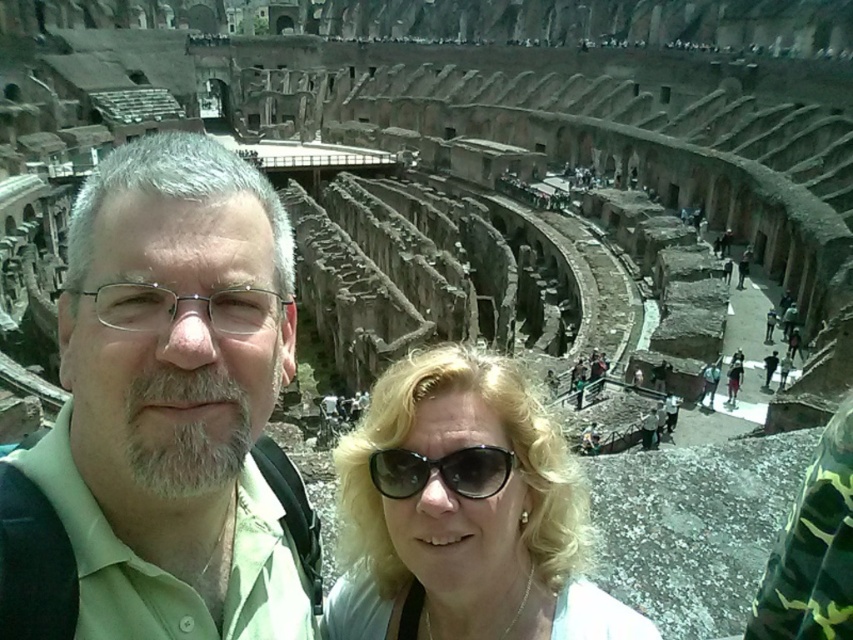
Does green matte shirt at center appear over black plastic sunglasses at center?

Correct, green matte shirt at center is located above black plastic sunglasses at center.

You are a GUI agent. You are given a task and a screenshot of the screen. Output one action in this format:
    pyautogui.click(x=<x>, y=<y>)
    Task: Click on the green matte shirt at center
    The image size is (853, 640).
    Given the screenshot: What is the action you would take?
    pyautogui.click(x=173, y=397)

Which is in front, point (189, 474) or point (397, 483)?

Point (189, 474) is in front.

Locate an element on the screen. The width and height of the screenshot is (853, 640). green matte shirt at center is located at coordinates (173, 397).

Is point (184, 563) less distant than point (389, 397)?

Yes.

Is green matte shirt at center to the left of blonde hair at center from the viewer's perspective?

Correct, you'll find green matte shirt at center to the left of blonde hair at center.

Which is in front, point (99, 237) or point (425, 349)?

Point (99, 237) is in front.

You are a GUI agent. You are given a task and a screenshot of the screen. Output one action in this format:
    pyautogui.click(x=<x>, y=<y>)
    Task: Click on the green matte shirt at center
    This screenshot has width=853, height=640.
    Given the screenshot: What is the action you would take?
    pyautogui.click(x=173, y=397)

Which is behind, point (506, 582) or point (426, 467)?

Point (426, 467)

Who is higher up, blonde hair at center or black plastic sunglasses at center?

black plastic sunglasses at center

This screenshot has width=853, height=640. What do you see at coordinates (463, 513) in the screenshot?
I see `blonde hair at center` at bounding box center [463, 513].

Where is `blonde hair at center`? This screenshot has width=853, height=640. blonde hair at center is located at coordinates (463, 513).